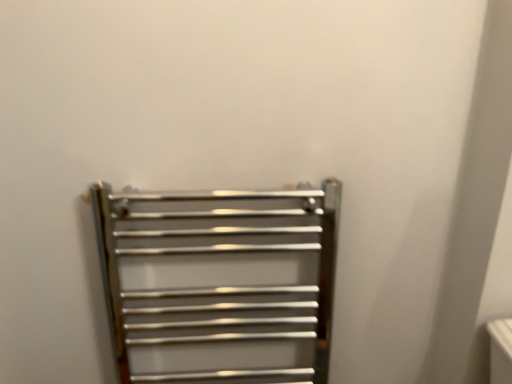
This screenshot has width=512, height=384. Identify the location of polished chrome towel rack at center. (219, 283).

This screenshot has height=384, width=512. Describe the element at coordinates (219, 283) in the screenshot. I see `polished chrome towel rack at center` at that location.

At what (x,y) coordinates should I click in order to perform the action: click on polished chrome towel rack at center. Please return your answer as a coordinate pair (x, y). Looking at the image, I should click on (219, 283).